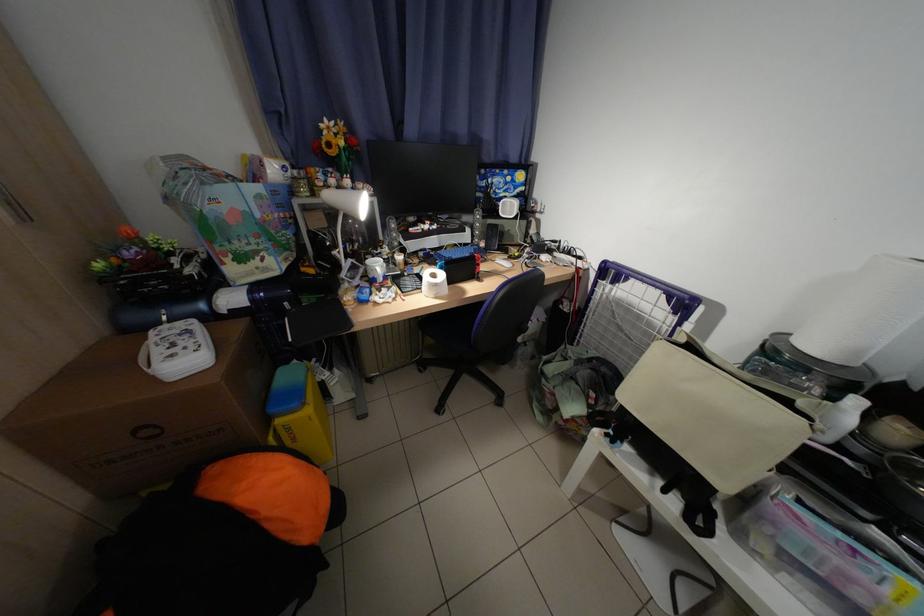
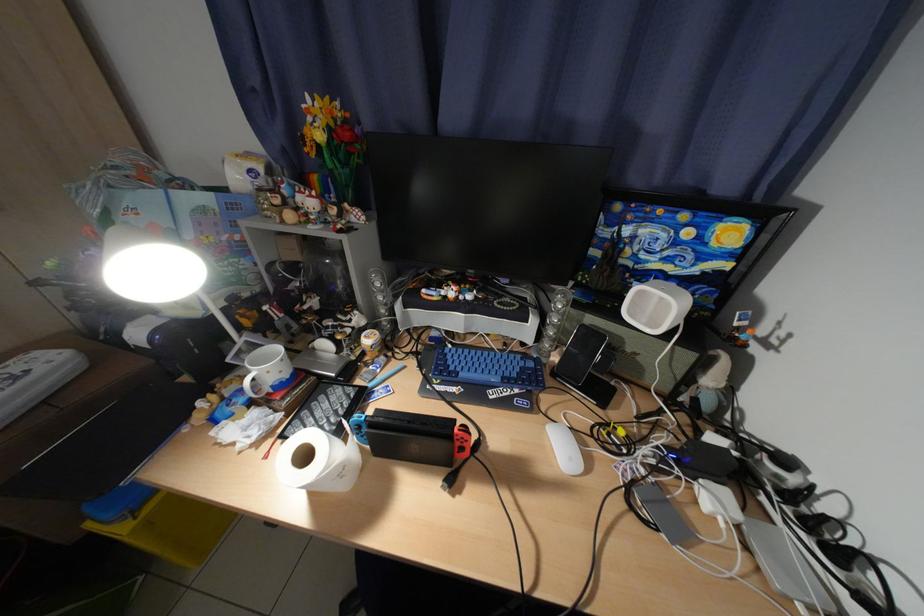
Where in the second image is the point corresponding to pixel 501 182 from the first image?

(638, 233)